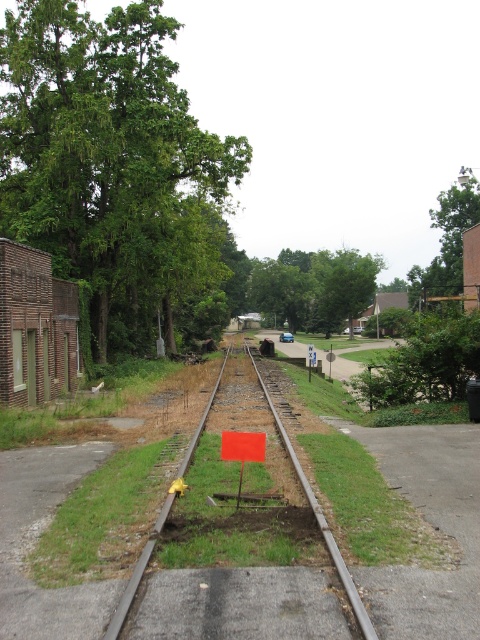
You are standing at the brick building with a greenish hue on the left side of the railway tracks. You want to walk to the small orange rectangular sign on the grass beside the tracks. Which direction should you walk relative to the point at coordinates point (145, 563) and point (228, 458)?

You should walk towards the point at coordinates point (145, 563) because it is in front of point (228, 458), so it is closer to your starting position at the brick building.

You are a pedestrian standing at the edge of the paved road near the stop sign. You see the smooth metal train track at center and the blue plastic sign at center. Which object is closer to you?

The smooth metal train track at center is closer to the viewer than the blue plastic sign at center, so the smooth metal train track at center is closer to you.

You are a delivery driver approaching the tracks and see the smooth metal train track at center and the blue plastic sign at center. Which object is closer to the road on the right side?

The blue plastic sign at center is closer to the road on the right side because the smooth metal train track at center is smaller than blue plastic sign at center, indicating the sign is larger and possibly positioned nearer to the road.